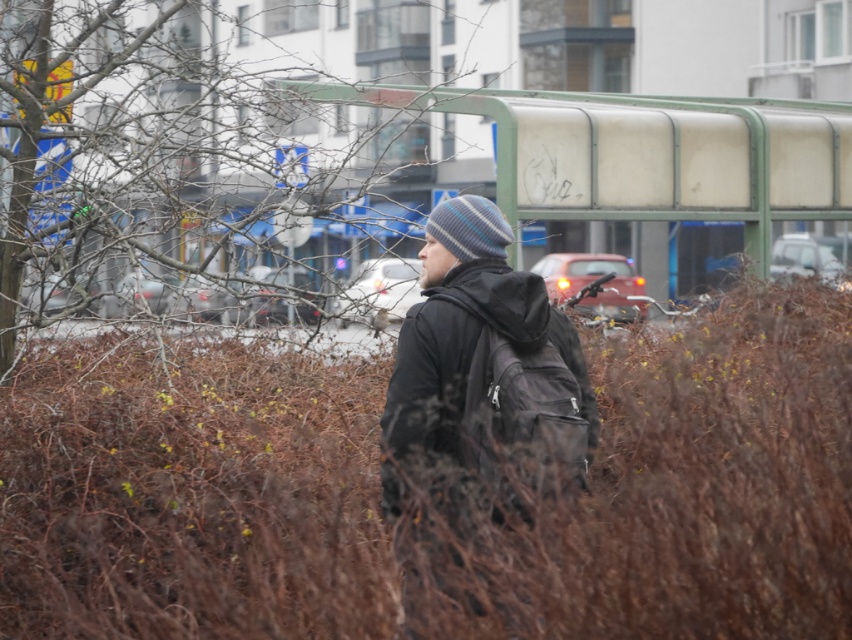
Question: Which point is closer to the camera?

Choices:
 (A) (60, 488)
 (B) (447, 365)
 (C) (426, 168)

Answer: (B)

Question: Considering the real-world distances, which object is closest to the bare branches at center?

Choices:
 (A) black matte jacket at center
 (B) brown dry bush at center

Answer: (A)

Question: Can you confirm if brown dry bush at center is positioned below bare branches at center?

Choices:
 (A) no
 (B) yes

Answer: (B)

Question: Among these points, which one is nearest to the camera?

Choices:
 (A) (540, 600)
 (B) (419, 312)
 (C) (340, 202)

Answer: (A)

Question: Can you confirm if brown dry bush at center is positioned to the right of bare branches at center?

Choices:
 (A) no
 (B) yes

Answer: (B)

Question: Is brown dry bush at center to the right of black matte jacket at center from the viewer's perspective?

Choices:
 (A) yes
 (B) no

Answer: (B)